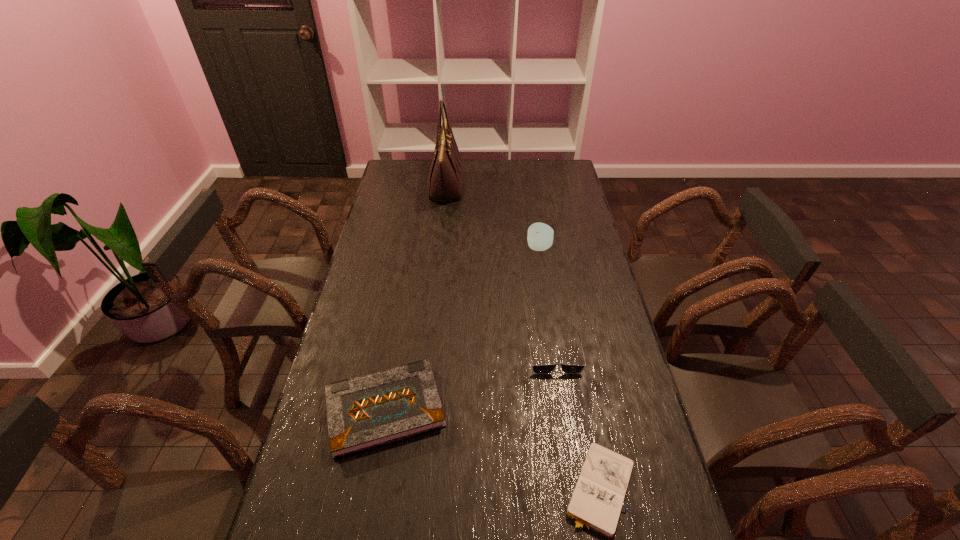
Locate an element on the screen. This screenshot has width=960, height=540. vacant point located on the front-facing side of the sunglasses is located at coordinates (567, 440).

Image resolution: width=960 pixels, height=540 pixels. Find the location of `vacant space located on the right of the taller notebook`. vacant space located on the right of the taller notebook is located at coordinates click(x=583, y=409).

The image size is (960, 540). Identify the location of blank space located on the left of the shorter notebook. (422, 488).

Image resolution: width=960 pixels, height=540 pixels. I want to click on object present at the far edge, so click(445, 179).

Identify the location of object that is at the left edge. (365, 412).

Locate an element on the screen. This screenshot has width=960, height=540. sunglasses positioned at the right edge is located at coordinates (538, 369).

What are the coordinates of `notebook that is at the right edge` in the screenshot? It's located at (596, 502).

At what (x,y) coordinates should I click in order to perform the action: click on free spot at the far edge of the desktop. Please return your answer as a coordinate pair (x, y). Looking at the image, I should click on (431, 165).

In the image, there is a desktop. Where is `vacant space at the left edge`? The width and height of the screenshot is (960, 540). vacant space at the left edge is located at coordinates (324, 379).

In the image, there is a desktop. Find the location of `vacant area at the right edge`. vacant area at the right edge is located at coordinates (612, 430).